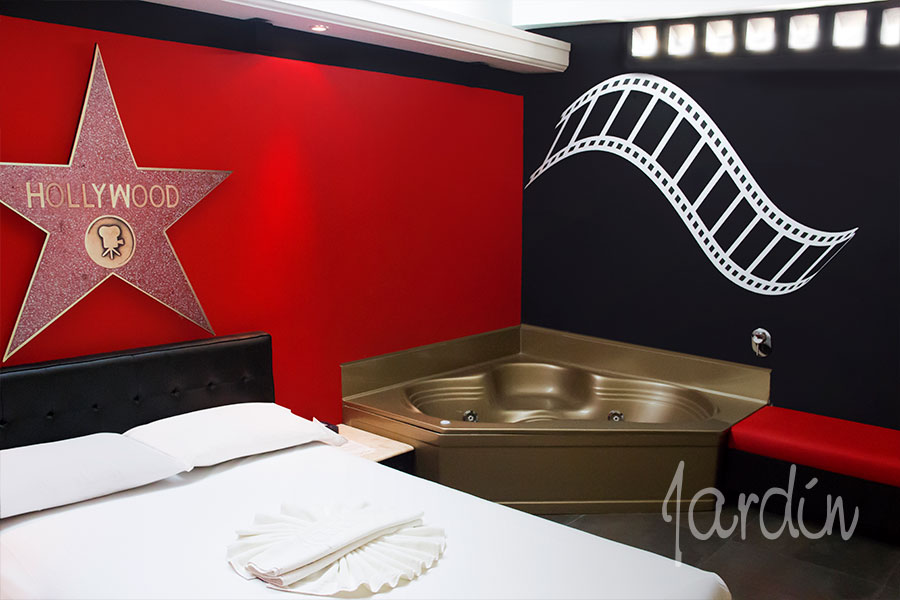
What are the coordinates of `pillow` in the screenshot? It's located at (99, 468).